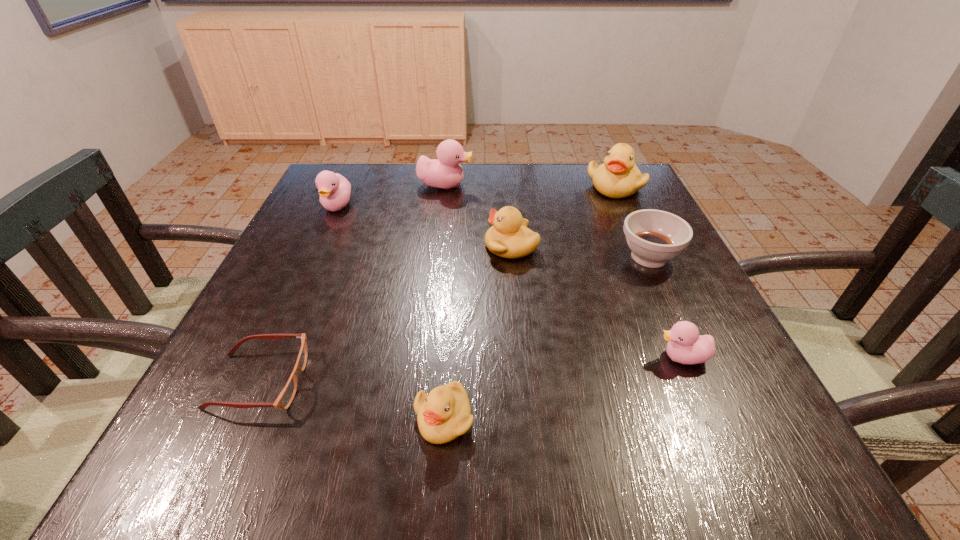
Find the location of a particular element. the smallest pink duckling is located at coordinates (685, 346).

Find the location of a particular element. The height and width of the screenshot is (540, 960). the smallest yellow duckling is located at coordinates (444, 414).

The height and width of the screenshot is (540, 960). What are the coordinates of `the leftmost yellow duckling` in the screenshot? It's located at [x=444, y=414].

Image resolution: width=960 pixels, height=540 pixels. In order to click on brown spectacles in this screenshot , I will do `click(286, 396)`.

Identify the location of spectacles. (286, 396).

Locate an element on the screen. The width and height of the screenshot is (960, 540). free space located on the front-facing side of the biggest pink duckling is located at coordinates (524, 185).

I want to click on blank area located 0.300m on the front-facing side of the rightmost yellow duckling, so [657, 276].

Identify the location of vacant space located 0.340m on the front-facing side of the leftmost pink duckling. (284, 322).

The height and width of the screenshot is (540, 960). I want to click on vacant region located on the front-facing side of the third duckling from right to left, so click(421, 246).

Where is `free space located 0.190m on the front-facing side of the third duckling from right to left`? The image size is (960, 540). free space located 0.190m on the front-facing side of the third duckling from right to left is located at coordinates (399, 246).